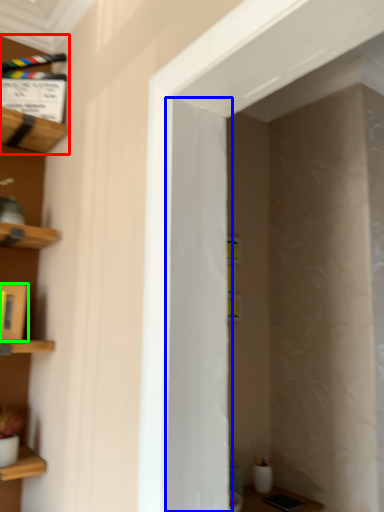
Question: Based on their relative distances, which object is farther from shelf (highlighted by a red box)? Choose from door (highlighted by a blue box) and cabinet (highlighted by a green box).

Choices:
 (A) door
 (B) cabinet

Answer: (A)